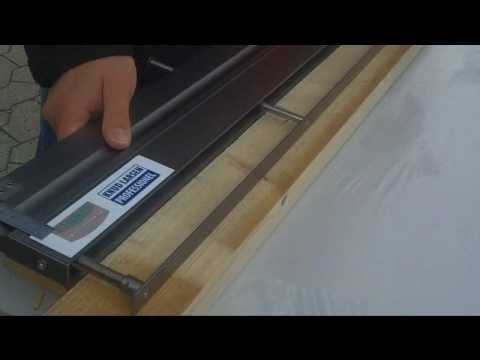
Find the location of a particular element. stone floor grey is located at coordinates [x=12, y=116].